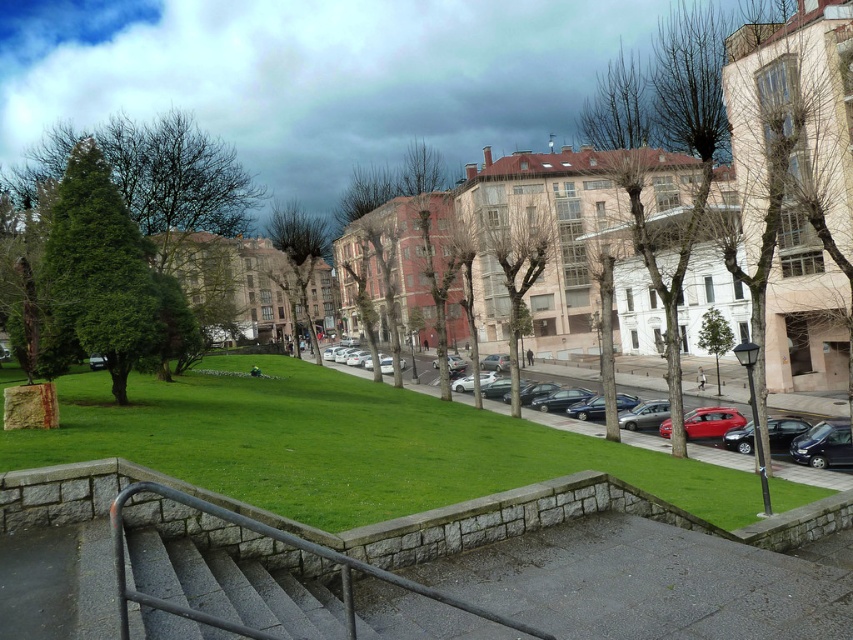
Question: Which of these objects is positioned closest to the green grass at center?

Choices:
 (A) bare branches at center
 (B) black metal stairs at lower left
 (C) green textured tree at left
 (D) green leafy tree at center

Answer: (B)

Question: Does green textured tree at left appear under black metal/rail at lower center?

Choices:
 (A) yes
 (B) no

Answer: (B)

Question: From the image, what is the correct spatial relationship of green leafy tree at left in relation to black metal/rail at lower center?

Choices:
 (A) right
 (B) left

Answer: (B)

Question: Estimate the real-world distances between objects in this image. Which object is farther from the shiny red car at lower right?

Choices:
 (A) bare branches at center
 (B) metallic silver car at lower center
 (C) green textured tree at left
 (D) green grass at center

Answer: (C)

Question: Is green grass at center positioned before bare branches at center?

Choices:
 (A) no
 (B) yes

Answer: (B)

Question: Which object is the farthest from the brown textured tree at center?

Choices:
 (A) green leafy tree at center
 (B) shiny black sedan at lower right
 (C) green grass at center

Answer: (B)